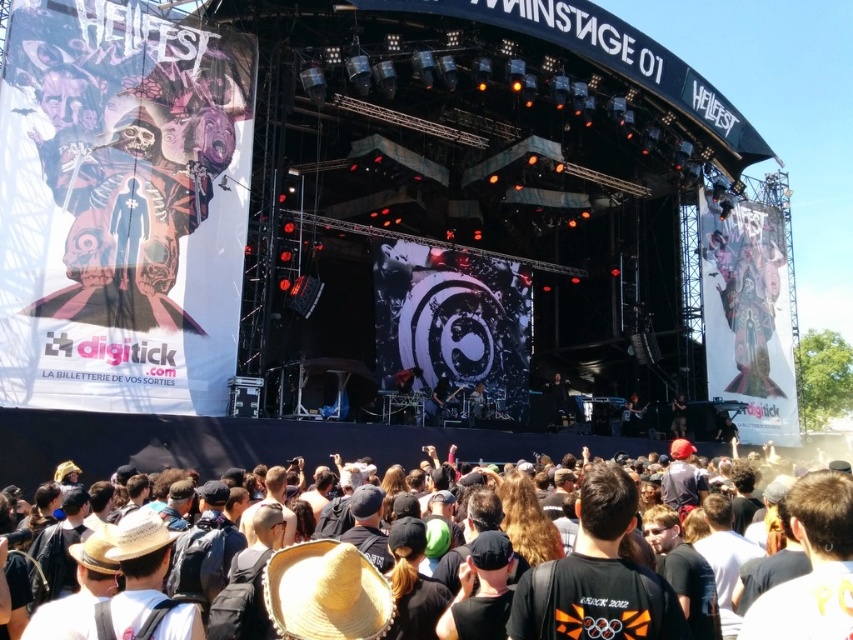
Question: Is black fabric crowd at lower center behind dark brown leather guitar at lower right?

Choices:
 (A) yes
 (B) no

Answer: (B)

Question: Among these objects, which one is nearest to the camera?

Choices:
 (A) dark brown leather guitar at lower right
 (B) matte black poster at upper right
 (C) black fabric crowd at lower center

Answer: (C)

Question: Is matte black poster at upper right above dark brown leather guitar at lower right?

Choices:
 (A) yes
 (B) no

Answer: (A)

Question: Which point is closer to the camera taking this photo?

Choices:
 (A) (636, 428)
 (B) (744, 380)
 (C) (152, 433)

Answer: (C)

Question: Is matte black poster at upper right to the left of dark brown leather guitar at lower right from the viewer's perspective?

Choices:
 (A) yes
 (B) no

Answer: (B)

Question: Among these points, which one is nearest to the camera?

Choices:
 (A) (634, 412)
 (B) (753, 305)
 (C) (564, 604)

Answer: (C)